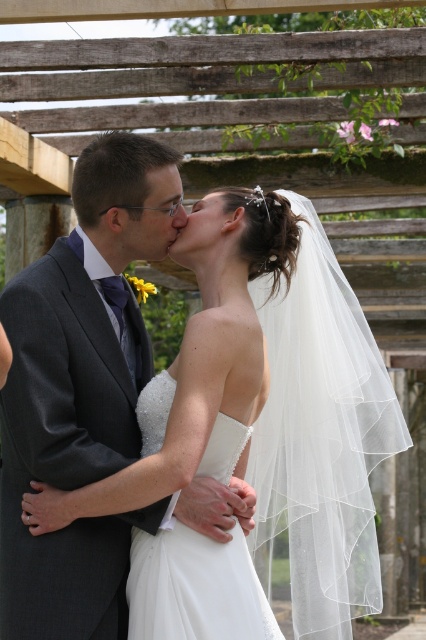
Question: Is white satin wedding dress at center bigger than matte white forehead at upper center?

Choices:
 (A) no
 (B) yes

Answer: (B)

Question: Is white satin wedding dress at center positioned before matte white forehead at upper center?

Choices:
 (A) no
 (B) yes

Answer: (B)

Question: Among these objects, which one is nearest to the camera?

Choices:
 (A) matte white forehead at upper center
 (B) white satin wedding dress at center

Answer: (B)

Question: From the image, what is the correct spatial relationship of white satin wedding dress at center in relation to matte white forehead at upper center?

Choices:
 (A) right
 (B) left

Answer: (B)